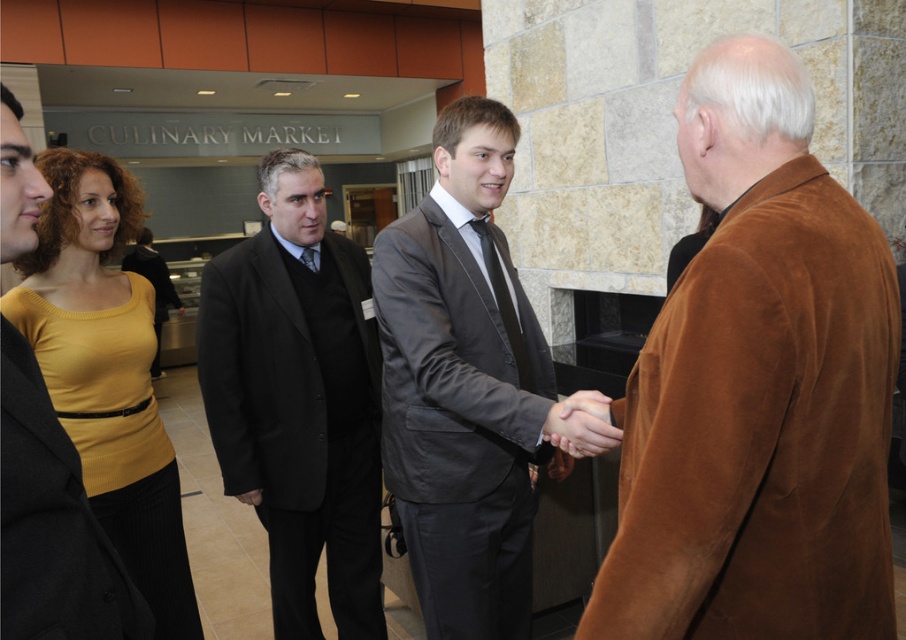
Question: Can you confirm if smooth leather hand at center is positioned to the right of black silk tie at center?

Choices:
 (A) no
 (B) yes

Answer: (B)

Question: Which of the following is the closest to the observer?

Choices:
 (A) black wool suit at center
 (B) black silk tie at center

Answer: (B)

Question: Which of the following is the closest to the observer?

Choices:
 (A) (596, 449)
 (B) (294, 390)

Answer: (A)

Question: Does brown suede jacket at right have a lesser width compared to black wool suit at center?

Choices:
 (A) yes
 (B) no

Answer: (A)

Question: Which of the following is the closest to the observer?

Choices:
 (A) smooth leather hand at center
 (B) yellow knit top at upper left

Answer: (A)

Question: Is brown suede jacket at right wider than black silk tie at center?

Choices:
 (A) yes
 (B) no

Answer: (A)